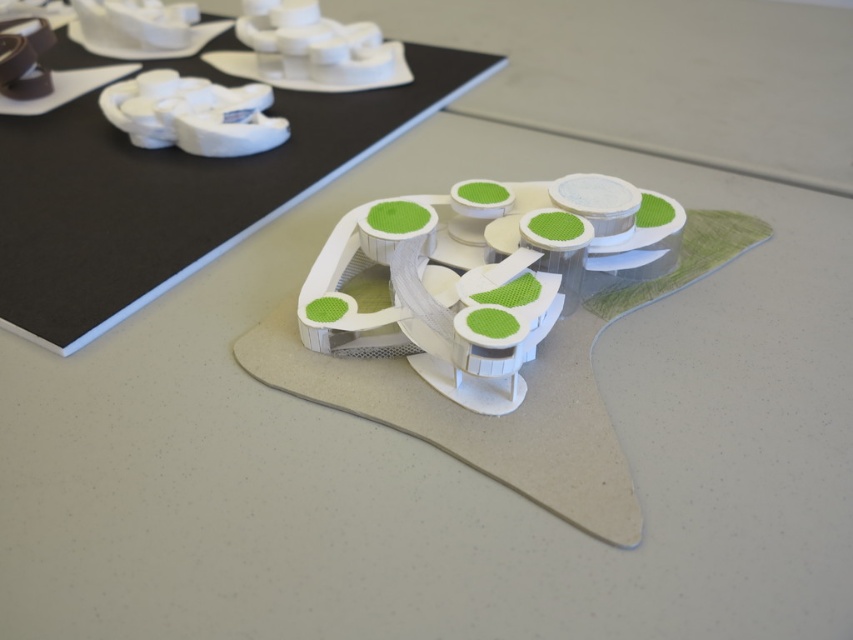
Question: Is white textured toy at center smaller than white matte toy at upper left?

Choices:
 (A) no
 (B) yes

Answer: (A)

Question: Is white textured toy at center bigger than white matte toy at upper left?

Choices:
 (A) yes
 (B) no

Answer: (A)

Question: Is white textured toy at center smaller than white matte toy at upper left?

Choices:
 (A) yes
 (B) no

Answer: (B)